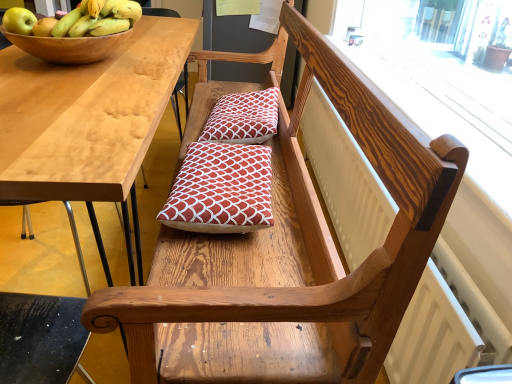
Question: Is red printed cushion at center, the 1th pillow from the front, positioned beyond the bounds of green matte apple at upper left?

Choices:
 (A) no
 (B) yes

Answer: (B)

Question: From a real-world perspective, is red printed cushion at center, the 1th pillow from the front, on top of green matte apple at upper left?

Choices:
 (A) yes
 (B) no

Answer: (B)

Question: Considering the relative sizes of red printed cushion at center, the first pillow positioned from the bottom, and green matte apple at upper left in the image provided, is red printed cushion at center, the first pillow positioned from the bottom, shorter than green matte apple at upper left?

Choices:
 (A) yes
 (B) no

Answer: (B)

Question: Does red printed cushion at center, the 1th pillow from the front, have a lesser width compared to green matte apple at upper left?

Choices:
 (A) yes
 (B) no

Answer: (B)

Question: From a real-world perspective, is red printed cushion at center, the first pillow positioned from the bottom, under green matte apple at upper left?

Choices:
 (A) no
 (B) yes

Answer: (B)

Question: Relative to light wood table at left, is yellow matte bananas at upper left in front or behind?

Choices:
 (A) front
 (B) behind

Answer: (B)

Question: Looking at their shapes, would you say yellow matte bananas at upper left is wider or thinner than light wood table at left?

Choices:
 (A) thin
 (B) wide

Answer: (A)

Question: From the image's perspective, is yellow matte bananas at upper left positioned above or below light wood table at left?

Choices:
 (A) above
 (B) below

Answer: (A)

Question: Is yellow matte bananas at upper left situated inside light wood table at left or outside?

Choices:
 (A) outside
 (B) inside

Answer: (A)

Question: Is red printed cushion at center, which is counted as the second pillow, starting from the front, taller or shorter than light wood table at left?

Choices:
 (A) short
 (B) tall

Answer: (A)

Question: In the image, is red printed cushion at center, the 2th pillow when ordered from bottom to top, on the left side or the right side of light wood table at left?

Choices:
 (A) right
 (B) left

Answer: (A)

Question: Relative to light wood table at left, is red printed cushion at center, which is counted as the second pillow, starting from the front, in front or behind?

Choices:
 (A) front
 (B) behind

Answer: (B)

Question: Which is correct: red printed cushion at center, positioned as the 1th pillow in top-to-bottom order, is inside light wood table at left, or outside of it?

Choices:
 (A) inside
 (B) outside

Answer: (B)

Question: Looking at the image, does green matte apple at upper left seem bigger or smaller compared to red printed cushion at center, positioned as the 1th pillow in top-to-bottom order?

Choices:
 (A) small
 (B) big

Answer: (A)

Question: Considering the positions of green matte apple at upper left and red printed cushion at center, the 1th pillow in the back-to-front sequence, in the image, is green matte apple at upper left taller or shorter than red printed cushion at center, the 1th pillow in the back-to-front sequence,?

Choices:
 (A) tall
 (B) short

Answer: (B)